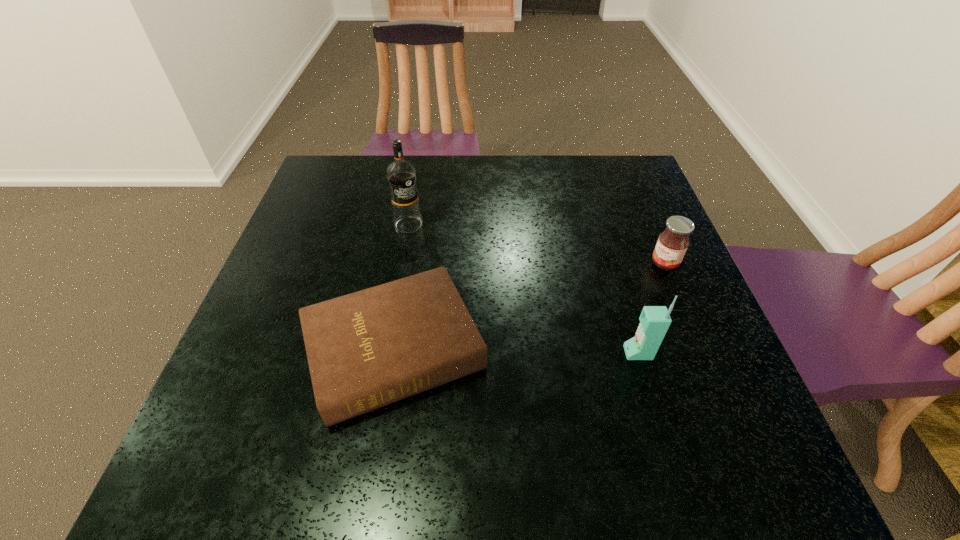
This screenshot has width=960, height=540. Identify the location of free space between the jam and the farthest object. (537, 244).

Image resolution: width=960 pixels, height=540 pixels. I want to click on vacant area between the tallest object and the cellular telephone, so click(523, 289).

Locate an element on the screen. The width and height of the screenshot is (960, 540). vacant area between the farthest object and the cellular telephone is located at coordinates (523, 289).

This screenshot has height=540, width=960. What are the coordinates of `free space between the Bible and the jam` in the screenshot? It's located at pos(530,307).

This screenshot has height=540, width=960. Identify the location of free space between the rightmost object and the shortest object. (530, 307).

I want to click on object that is the third closest to the jam, so [x=401, y=175].

I want to click on object that is the second closest to the third nearest object, so click(x=365, y=350).

This screenshot has width=960, height=540. Identify the location of free spot that satisfies the following two spatial constraints: 1. on the front side of the shortest object; 2. on the keypad of the second tallest object. (395, 353).

The width and height of the screenshot is (960, 540). What are the coordinates of `vacant region that satisfies the following two spatial constraints: 1. on the front side of the rightmost object; 2. on the left side of the vodka` in the screenshot? It's located at (402, 264).

The height and width of the screenshot is (540, 960). Find the location of `vacant space that satisfies the following two spatial constraints: 1. on the front side of the vodka; 2. on the keypad of the second object from right to left`. vacant space that satisfies the following two spatial constraints: 1. on the front side of the vodka; 2. on the keypad of the second object from right to left is located at coordinates (386, 353).